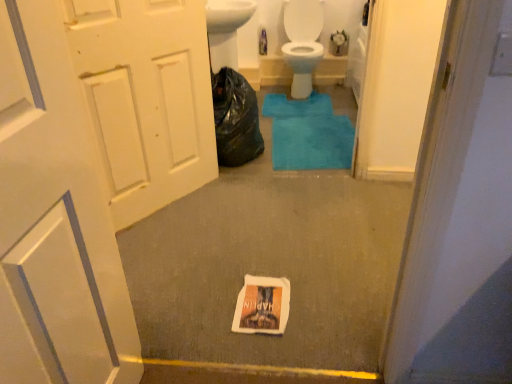
Question: Considering the relative positions of white matte door at left, the first door from the back, and white matte door at left, arranged as the second door when viewed from the back, in the image provided, is white matte door at left, the first door from the back, to the left of white matte door at left, arranged as the second door when viewed from the back, from the viewer's perspective?

Choices:
 (A) yes
 (B) no

Answer: (A)

Question: Can you confirm if white matte door at left, which appears as the second door when viewed from the front, is thinner than white matte door at left, the first door in the front-to-back sequence?

Choices:
 (A) yes
 (B) no

Answer: (B)

Question: Does white matte door at left, the first door from the back, have a smaller size compared to white matte door at left, arranged as the second door when viewed from the back?

Choices:
 (A) no
 (B) yes

Answer: (A)

Question: Considering the relative sizes of white matte door at left, the first door from the back, and white matte door at left, the first door in the front-to-back sequence, in the image provided, is white matte door at left, the first door from the back, bigger than white matte door at left, the first door in the front-to-back sequence,?

Choices:
 (A) no
 (B) yes

Answer: (B)

Question: Is white matte door at left, the first door from the back, closer to the viewer compared to white matte door at left, the first door in the front-to-back sequence?

Choices:
 (A) yes
 (B) no

Answer: (B)

Question: Is white paper flyer at center to the left or to the right of black plastic bag at center in the image?

Choices:
 (A) right
 (B) left

Answer: (A)

Question: Is white paper flyer at center wider or thinner than black plastic bag at center?

Choices:
 (A) thin
 (B) wide

Answer: (A)

Question: From the image's perspective, is white paper flyer at center located above or below black plastic bag at center?

Choices:
 (A) below
 (B) above

Answer: (A)

Question: Is point (252, 299) positioned closer to the camera than point (247, 96)?

Choices:
 (A) closer
 (B) farther

Answer: (A)

Question: Would you say white matte door at left, the first door in the front-to-back sequence, is to the left or to the right of white paper flyer at center in the picture?

Choices:
 (A) right
 (B) left

Answer: (B)

Question: Looking at the image, does white matte door at left, arranged as the second door when viewed from the back, seem bigger or smaller compared to white paper flyer at center?

Choices:
 (A) small
 (B) big

Answer: (B)

Question: From a real-world perspective, relative to white paper flyer at center, is white matte door at left, arranged as the second door when viewed from the back, vertically above or below?

Choices:
 (A) below
 (B) above

Answer: (B)

Question: Is point (92, 206) closer or farther from the camera than point (247, 329)?

Choices:
 (A) farther
 (B) closer

Answer: (B)

Question: In the image, is white glossy toilet at center on the left side or the right side of white matte door at left, which appears as the second door when viewed from the front?

Choices:
 (A) right
 (B) left

Answer: (A)

Question: Do you think white glossy toilet at center is within white matte door at left, the first door from the back, or outside of it?

Choices:
 (A) outside
 (B) inside

Answer: (A)